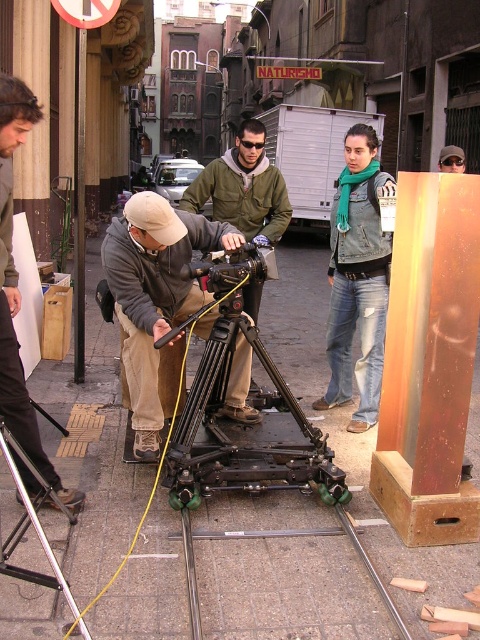
Question: Based on their relative distances, which object is nearer to the green scarf at upper center?

Choices:
 (A) khaki fabric hat at center
 (B) denim jacket at upper right
 (C) green matte jacket at center
 (D) dark brown leather jacket at left

Answer: (C)

Question: Estimate the real-world distances between objects in this image. Which object is farther from the dark brown leather jacket at left?

Choices:
 (A) black matte camera on the left
 (B) khaki fabric hat at center
 (C) denim jacket at upper right

Answer: (C)

Question: Can you confirm if green matte jacket at center is thinner than green scarf at upper center?

Choices:
 (A) no
 (B) yes

Answer: (A)

Question: Is green matte jacket at center bigger than green scarf at upper center?

Choices:
 (A) yes
 (B) no

Answer: (A)

Question: Which of the following is the farthest from the observer?

Choices:
 (A) (137, 420)
 (B) (179, 444)
 (C) (373, 285)

Answer: (C)

Question: Is khaki fabric hat at center to the left of metallic train track at center from the viewer's perspective?

Choices:
 (A) no
 (B) yes

Answer: (B)